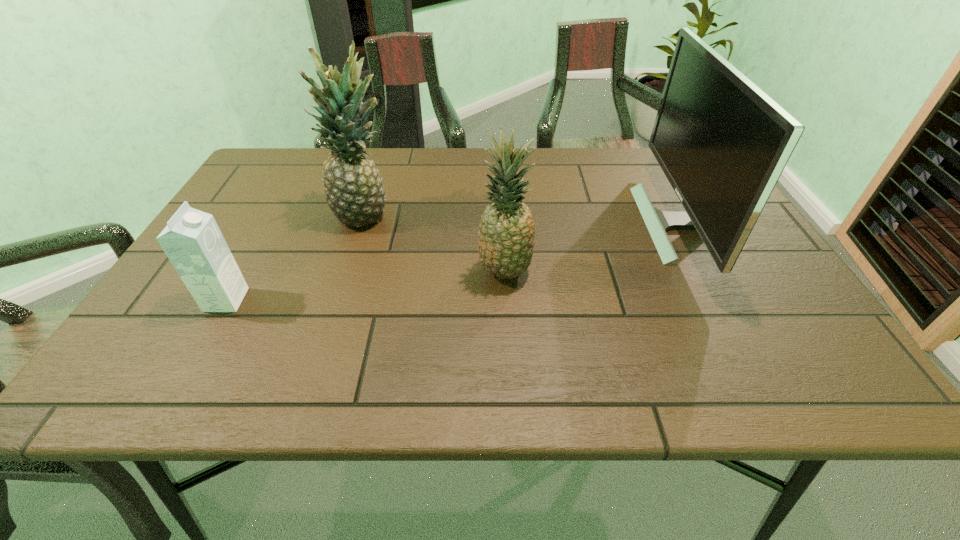
Identify the location of object identified as the third closest to the monitor. (192, 240).

The image size is (960, 540). Identify the location of object that is the second nearest to the leftmost object. (506, 241).

The image size is (960, 540). Find the location of `blank area in the image that satisfies the following two spatial constraints: 1. on the front side of the third object from left to right; 2. on the right side of the second object from left to right`. blank area in the image that satisfies the following two spatial constraints: 1. on the front side of the third object from left to right; 2. on the right side of the second object from left to right is located at coordinates tap(347, 272).

I want to click on free space that satisfies the following two spatial constraints: 1. on the screen side of the rightmost object; 2. on the front side of the nearer pineapple, so click(x=704, y=272).

Where is `vacant area in the image that satisfies the following two spatial constraints: 1. on the front side of the third tallest object; 2. on the front label of the carton`? The image size is (960, 540). vacant area in the image that satisfies the following two spatial constraints: 1. on the front side of the third tallest object; 2. on the front label of the carton is located at coordinates (506, 300).

Locate an element on the screen. vacant area that satisfies the following two spatial constraints: 1. on the front side of the right pineapple; 2. on the left side of the taller pineapple is located at coordinates (347, 272).